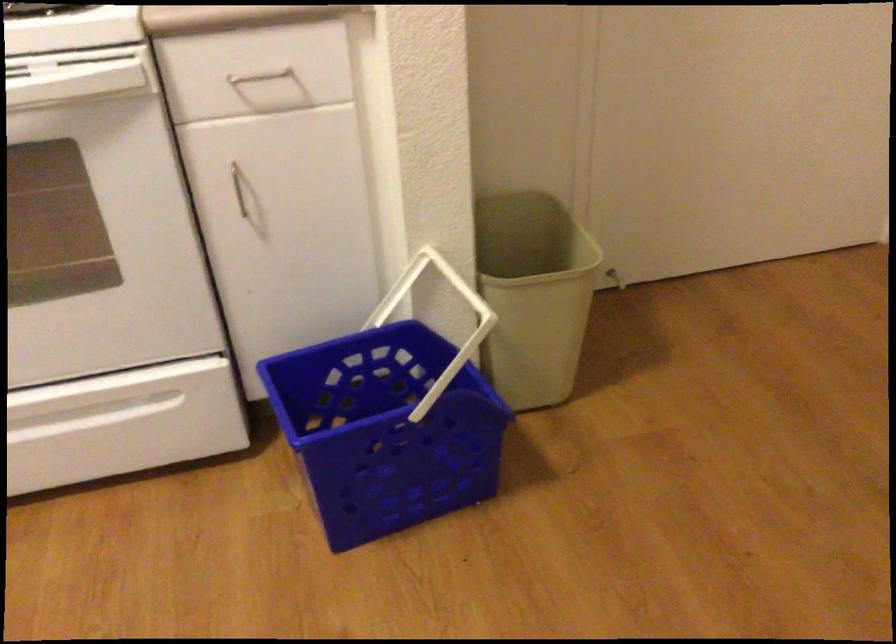
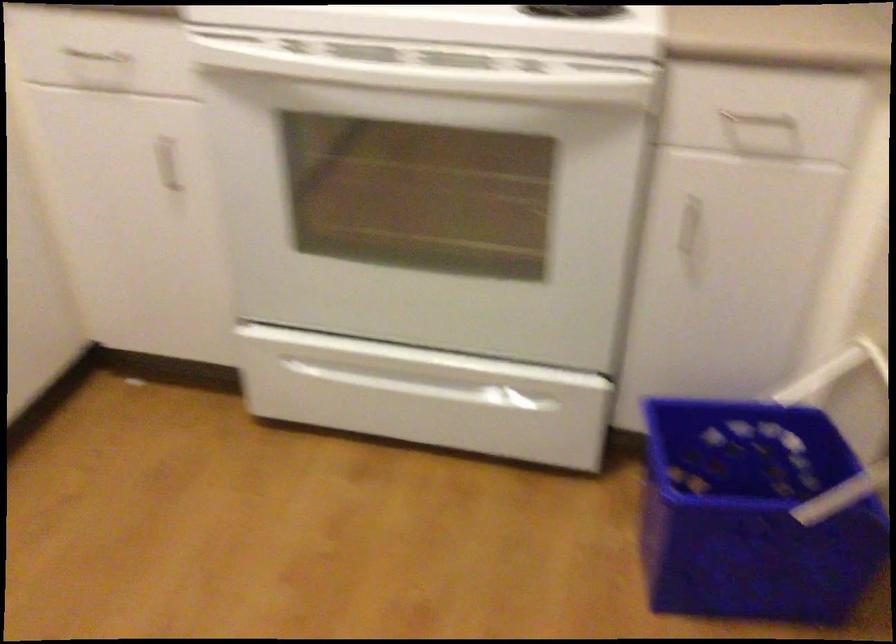
In the second image, find the point that corresponds to (x=383, y=431) in the first image.

(752, 514)